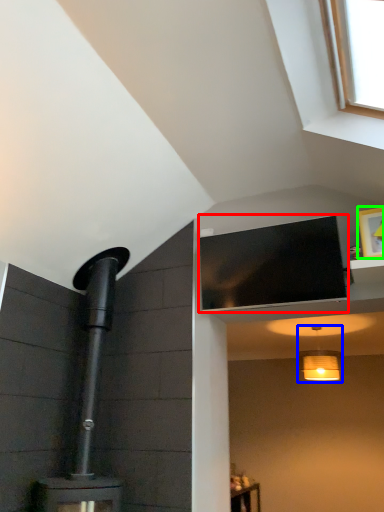
Question: Which object is the farthest from window screen (highlighted by a red box)? Choose among these: light fixture (highlighted by a blue box) or picture frame (highlighted by a green box).

Choices:
 (A) light fixture
 (B) picture frame

Answer: (A)